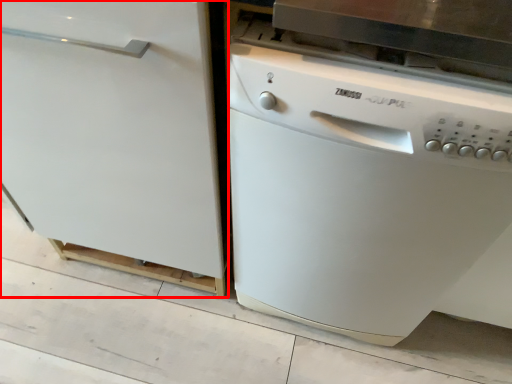
Question: From the image's perspective, considering the relative positions of home appliance (annotated by the red box) and dish washer in the image provided, where is home appliance (annotated by the red box) located with respect to the staircase?

Choices:
 (A) above
 (B) below

Answer: (A)